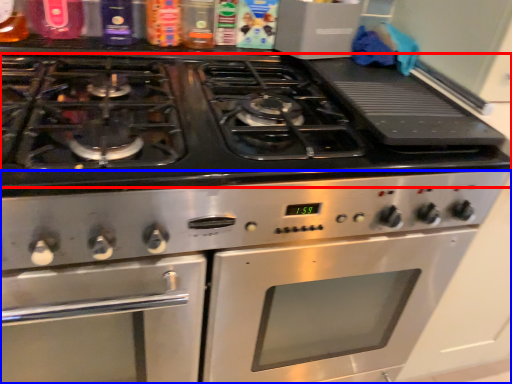
Question: Which point is closer to the camera, gas stove (highlighted by a red box) or oven (highlighted by a blue box)?

Choices:
 (A) gas stove
 (B) oven

Answer: (A)